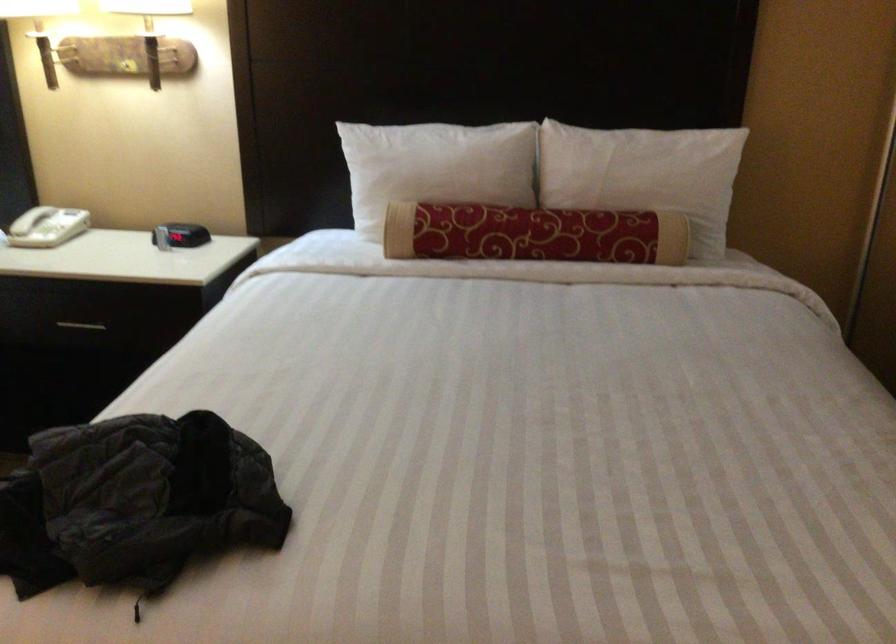
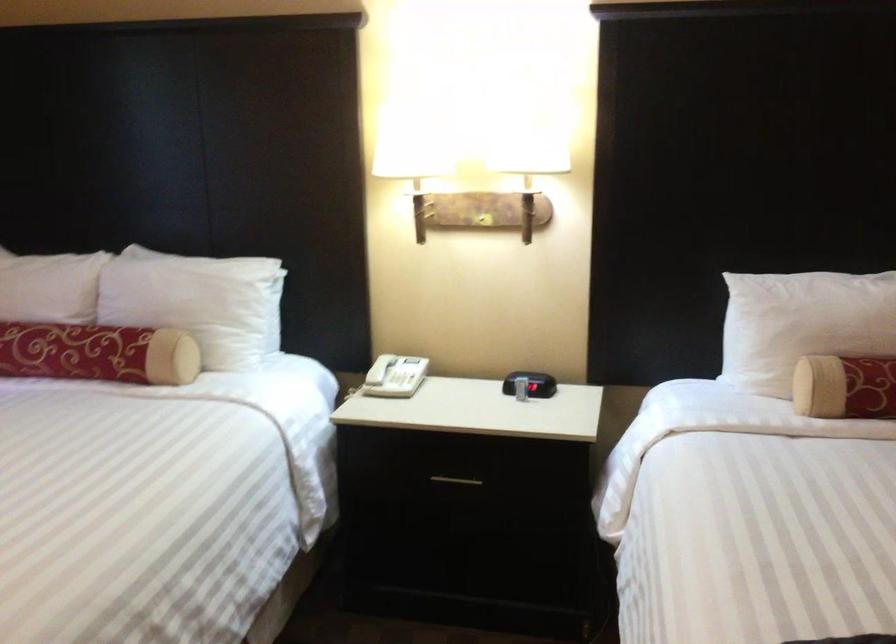
In the second image, find the point that corresponds to [80,325] in the first image.

(455, 480)